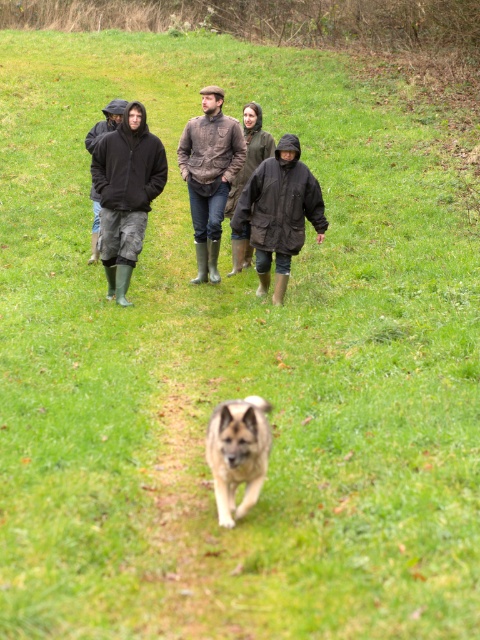
Who is positioned more to the right, matte black jacket at left or matte black jacket at center?

matte black jacket at center

Is the position of matte black jacket at left less distant than that of matte black jacket at center?

No, it is not.

Image resolution: width=480 pixels, height=640 pixels. What are the coordinates of `matte black jacket at left` in the screenshot? It's located at (126, 193).

Locate an element on the screen. This screenshot has width=480, height=640. matte black jacket at left is located at coordinates (126, 193).

How far apart are matte black jacket at left and brown leather jacket at center?

A distance of 3.58 feet exists between matte black jacket at left and brown leather jacket at center.

From the picture: Who is more forward, (120,272) or (199,280)?

Point (120,272) is more forward.

This screenshot has width=480, height=640. In order to click on matte black jacket at left in this screenshot , I will do `click(126, 193)`.

Does brown leather jacket at center appear under light brown fur at center?

Actually, brown leather jacket at center is above light brown fur at center.

At what (x,y) coordinates should I click in order to perform the action: click on brown leather jacket at center. Please return your answer as a coordinate pair (x, y). The height and width of the screenshot is (640, 480). Looking at the image, I should click on (210, 176).